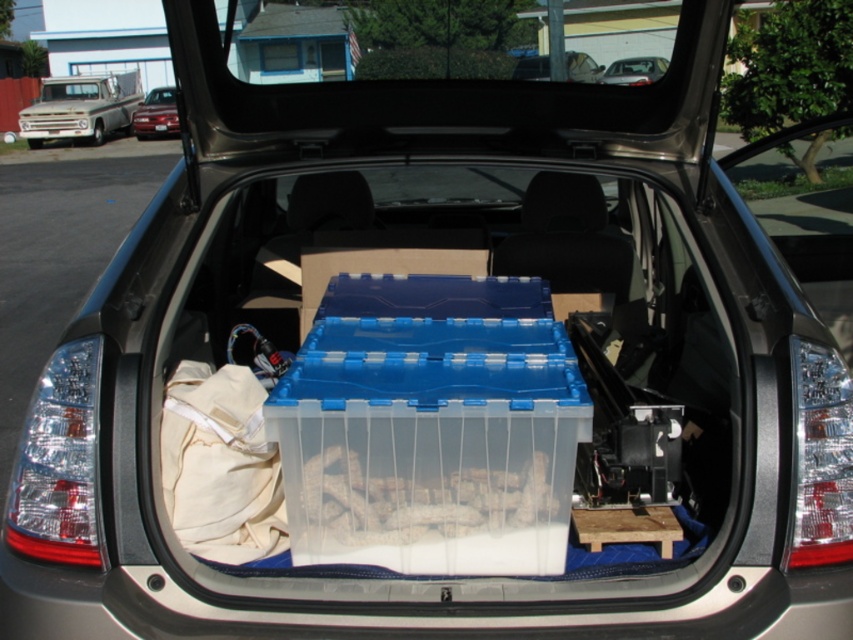
Which is below, matte silver truck at upper left or matte blue plastic container at center?

matte blue plastic container at center is lower down.

The height and width of the screenshot is (640, 853). Find the location of `matte silver truck at upper left`. matte silver truck at upper left is located at coordinates (80, 108).

Is shiny red sedan at upper left to the right of matte blue plastic container at center from the viewer's perspective?

In fact, shiny red sedan at upper left is to the left of matte blue plastic container at center.

Does shiny red sedan at upper left appear on the left side of matte blue plastic container at center?

Correct, you'll find shiny red sedan at upper left to the left of matte blue plastic container at center.

Identify the location of shiny red sedan at upper left. The width and height of the screenshot is (853, 640). (155, 113).

You are a GUI agent. You are given a task and a screenshot of the screen. Output one action in this format:
    pyautogui.click(x=<x>, y=<y>)
    Task: Click on the shiny red sedan at upper left
    
    Given the screenshot: What is the action you would take?
    pyautogui.click(x=155, y=113)

Can you confirm if matte silver truck at upper left is shorter than shiny red sedan at upper left?

No.

The height and width of the screenshot is (640, 853). Describe the element at coordinates (80, 108) in the screenshot. I see `matte silver truck at upper left` at that location.

Is point (30, 128) more distant than point (169, 131)?

That is False.

This screenshot has height=640, width=853. I want to click on matte silver truck at upper left, so click(80, 108).